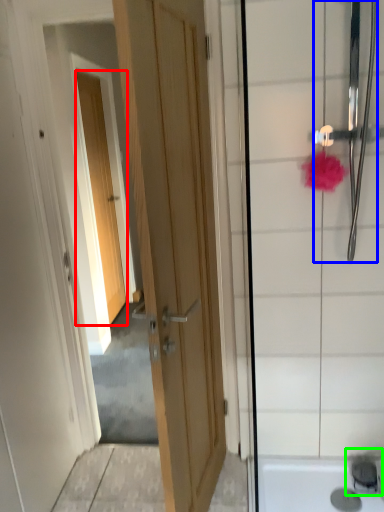
Question: Which object is positioned closest to door (highlighted by a red box)? Select from shower (highlighted by a blue box) and faucet (highlighted by a green box).

Choices:
 (A) shower
 (B) faucet

Answer: (A)